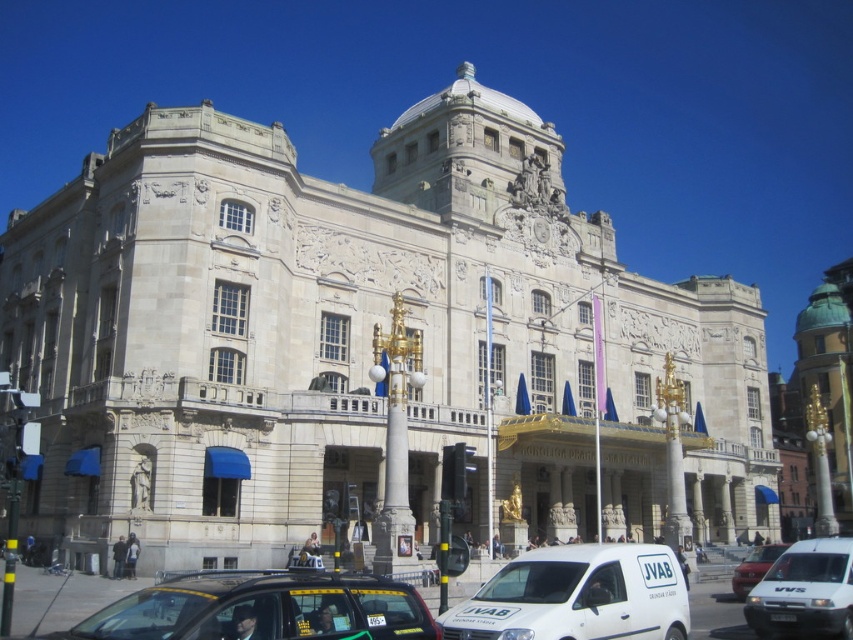
You are a delivery driver who needs to park your white matte van at lower right near the entrance of the grand building. However, there is already a white van at center blocking the path. Can your van fit in the space between the lampposts and the building entrance?

The white matte van at lower right is smaller than the white van at center, so it may fit in the space between the lampposts and the building entrance if the existing van is blocking part of the path.

You are a delivery driver who needs to park your white matte van at lower center near the entrance of the grand building. However, there is already a white van at center parked there. Can you park your van without overlapping the existing one?

The white matte van at lower center occupies less space than the white van at center, so you can park your van without overlapping the existing one by positioning it in an area that doesn